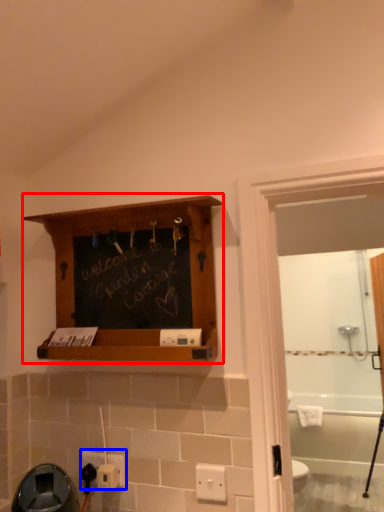
Question: Which of the following is the closest to the observer, shelf (highlighted by a red box) or electric outlet (highlighted by a blue box)?

Choices:
 (A) shelf
 (B) electric outlet

Answer: (A)